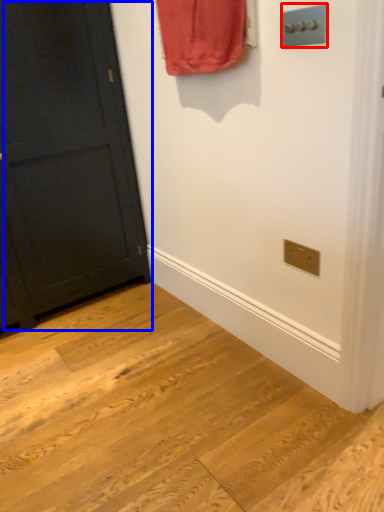
Question: Which object is closer to the camera taking this photo, light switch (highlighted by a red box) or door (highlighted by a blue box)?

Choices:
 (A) light switch
 (B) door

Answer: (A)